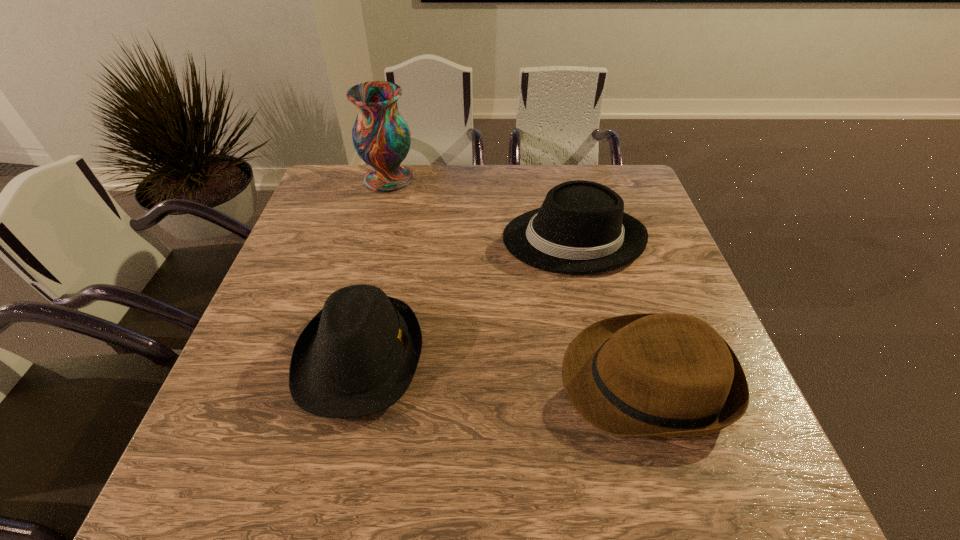
Image resolution: width=960 pixels, height=540 pixels. In order to click on free space between the third nearest object and the leftmost fedora in this screenshot , I will do `click(467, 298)`.

Image resolution: width=960 pixels, height=540 pixels. In order to click on free space between the third nearest object and the leftmost fedora in this screenshot , I will do `click(467, 298)`.

The height and width of the screenshot is (540, 960). What are the coordinates of `free space between the leftmost fedora and the farthest object` in the screenshot? It's located at (374, 268).

Where is `the third closest object to the farthest fedora`? The width and height of the screenshot is (960, 540). the third closest object to the farthest fedora is located at coordinates tap(381, 137).

You are a GUI agent. You are given a task and a screenshot of the screen. Output one action in this format:
    pyautogui.click(x=<x>, y=<y>)
    Task: Click on the object that is the third closest to the leftmost fedora
    The width and height of the screenshot is (960, 540).
    Given the screenshot: What is the action you would take?
    pyautogui.click(x=381, y=137)

Locate which fedora ranks second in proximity to the leftmost fedora. Please provide its 2D coordinates. Your answer should be formatted as a tuple, i.e. [(x, y)], where the tuple contains the x and y coordinates of a point satisfying the conditions above.

[(650, 374)]

Locate which fedora ranks second in proximity to the farthest fedora. Please provide its 2D coordinates. Your answer should be formatted as a tuple, i.e. [(x, y)], where the tuple contains the x and y coordinates of a point satisfying the conditions above.

[(358, 355)]